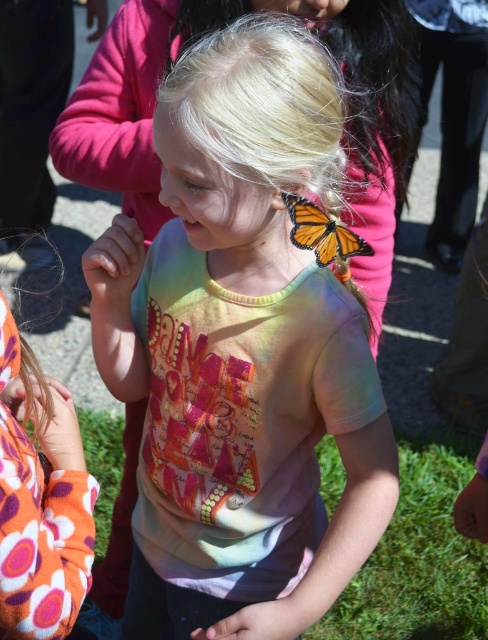
Question: Is pastel tie-dye t-shirt at center to the left of translucent orange butterfly at upper center from the viewer's perspective?

Choices:
 (A) yes
 (B) no

Answer: (A)

Question: Is pastel tie-dye t-shirt at center thinner than translucent orange butterfly at upper center?

Choices:
 (A) no
 (B) yes

Answer: (A)

Question: Is pastel tie-dye t-shirt at center in front of translucent orange butterfly at upper center?

Choices:
 (A) yes
 (B) no

Answer: (A)